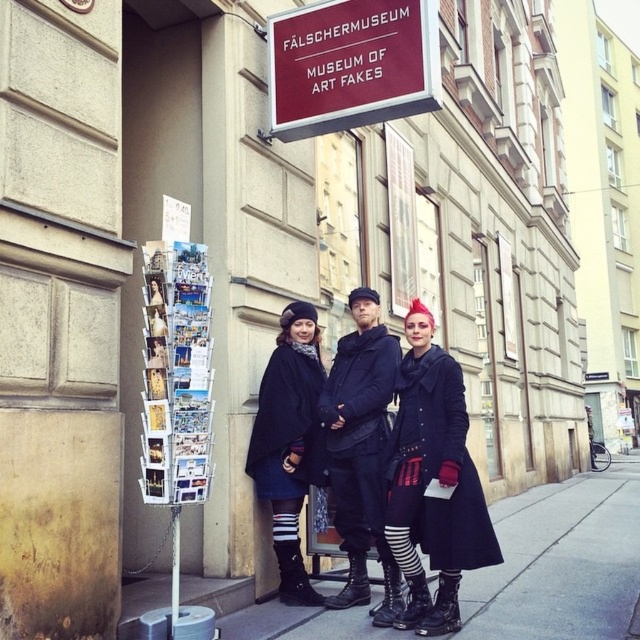
You are a visitor at the FALSCHERMUSEUM. You see the concrete sidewalk at lower center and the dark blue fabric dress at center. Which object is positioned lower in the image?

The concrete sidewalk at lower center is located below the dark blue fabric dress at center, so it is positioned lower in the image.

You are a photographer trying to capture the entire scene of the FALSCHERMUSEUM entrance with the three people. Since the concrete sidewalk at lower center and the black leather jacket at center are in your shot, which one takes up more space in the photo?

The black leather jacket at center takes up more space in the photo because the concrete sidewalk at lower center occupies less space than black leather jacket at center according to the description.

You are a delivery person trying to park your 1.5 meter wide delivery van on the concrete sidewalk at lower center. Can the van fit on the sidewalk? Use the maroon matte sign at upper center as a reference for the sidewalk width.

The concrete sidewalk at lower center is narrower than the maroon matte sign at upper center. Since the van is 1.5 meters wide and the sidewalk is narrower than the sign, it might not be wide enough to accommodate the van safely. Check the actual width before parking.